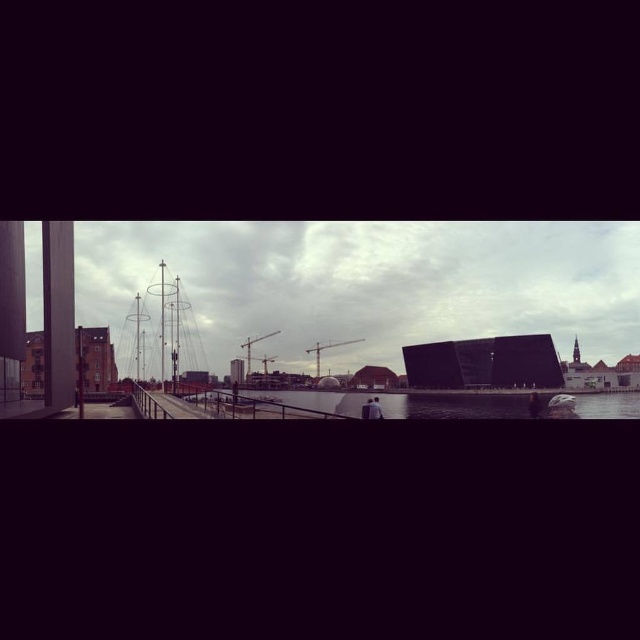
You are a pedestrian standing on the walkway and want to cross to the other side of the transparent glass water at center. The metallic bridge at center is your only option. Is the bridge positioned to the left or right of the water?

The metallic bridge at center is to the left of the transparent glass water at center, so you should head towards the left side to find the bridge.

Based on the photo, you are standing at the point with coordinates point (452, 404) and want to see the transparent glass water at center. Is the transparent glass water at center visible from your current position?

The point (452, 404) corresponds to transparent glass water at center, so yes, the transparent glass water at center is visible from your current position.

You are a pedestrian standing on the walkway and want to cross to the other side of the transparent glass water at center. The metallic bridge at center is the only path available. Is the bridge directly above the water?

Yes, the metallic bridge at center is directly above the transparent glass water at center since the water is located below the bridge.